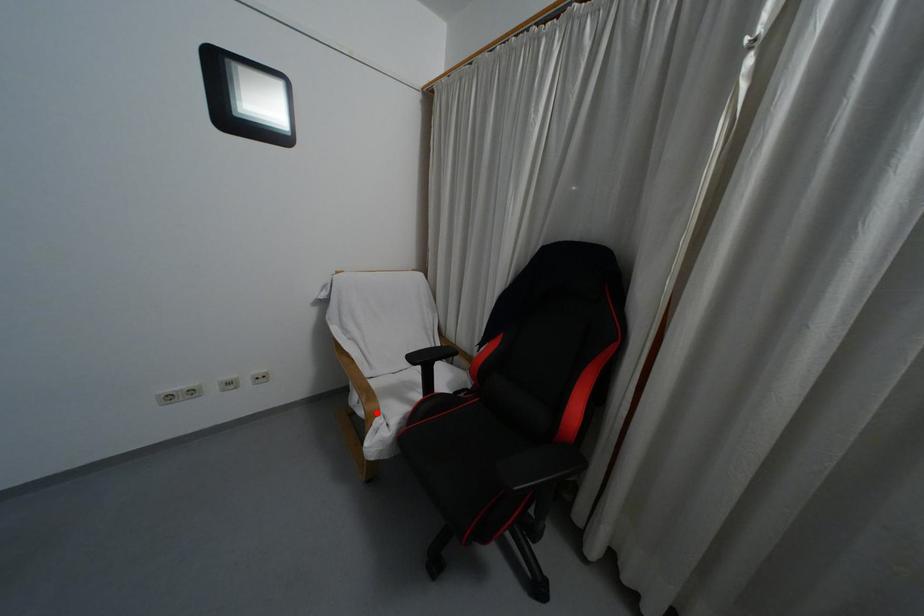
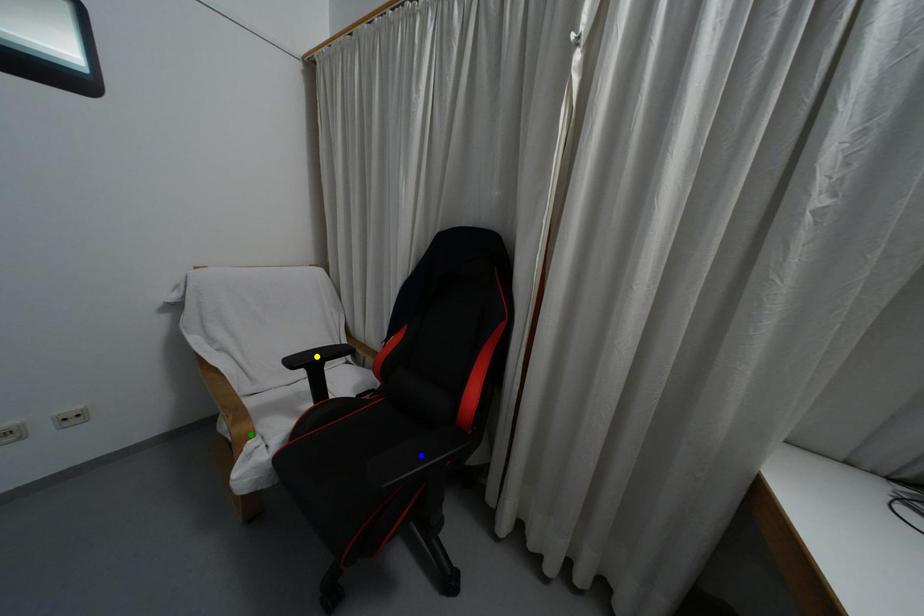
Question: I am providing you with two images of the same scene from different viewpoints. A red point is marked on the first image. You are given multiple points on the second image. Which point in image 2 represents the same 3d spot as the red point in image 1?

Choices:
 (A) blue point
 (B) yellow point
 (C) green point

Answer: (C)